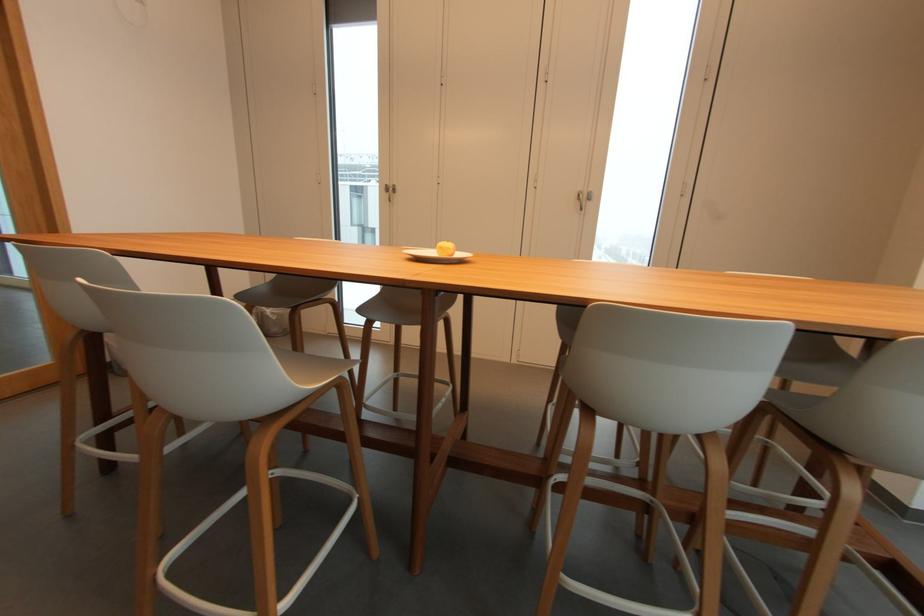
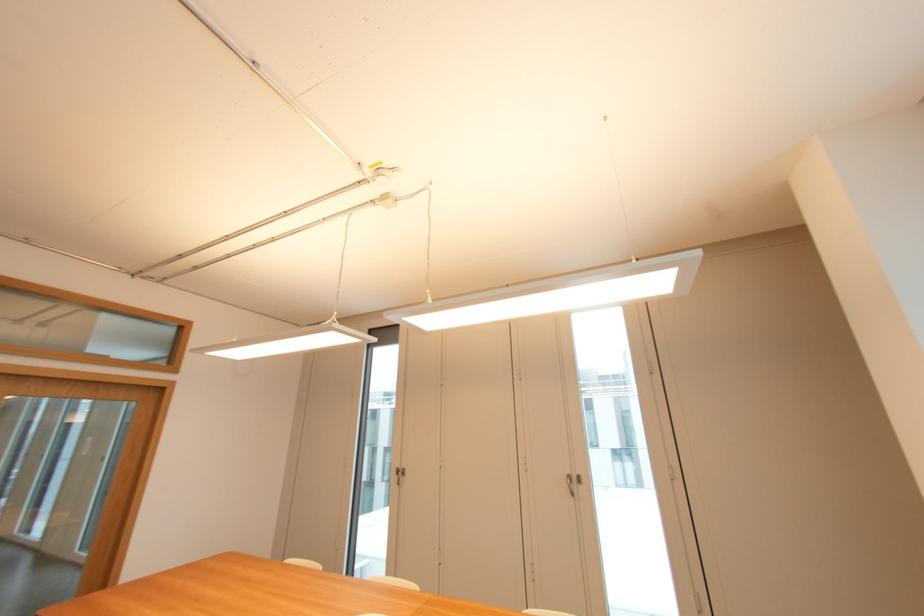
Find the pixel in the second image that matches point (585, 188) in the first image.

(574, 472)